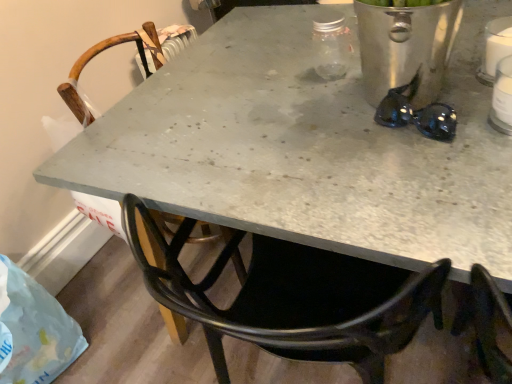
This screenshot has height=384, width=512. I want to click on vacant point to the left of black shiny sunglasses at upper right, so click(x=329, y=141).